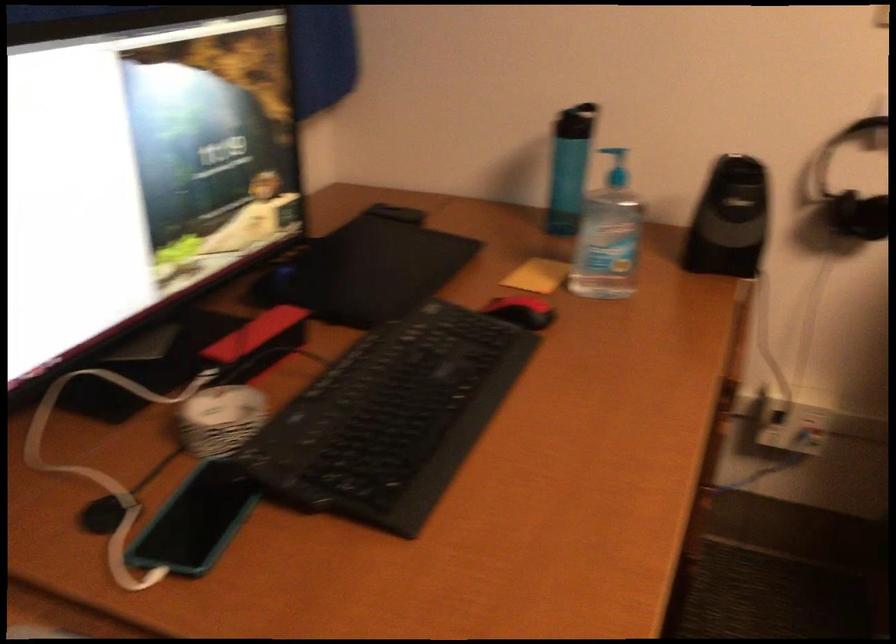
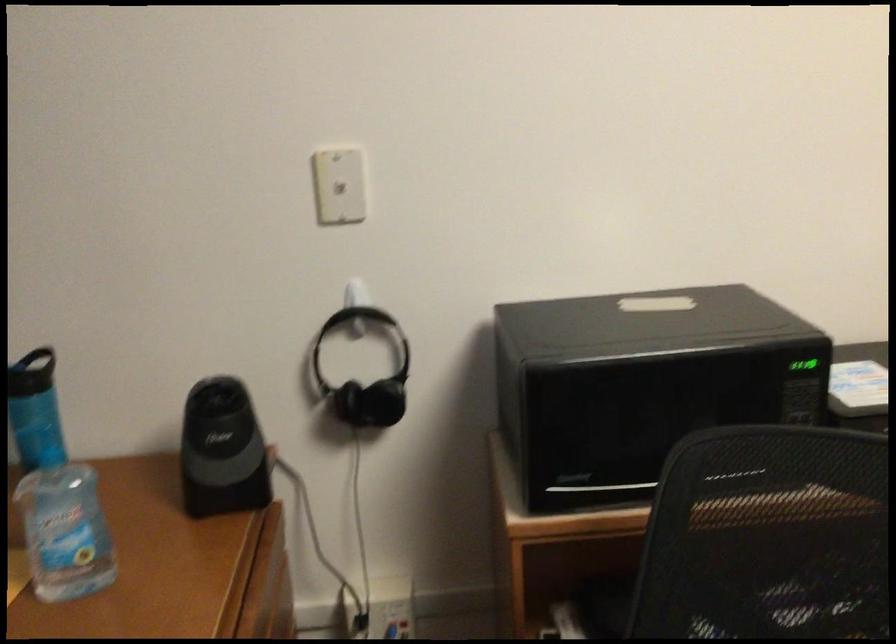
Locate, in the second image, the point that corresponds to point 608,259 in the first image.

(67, 556)